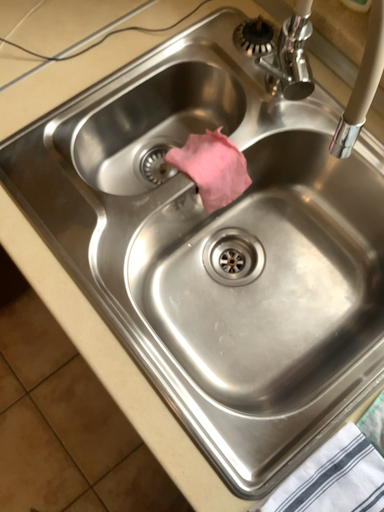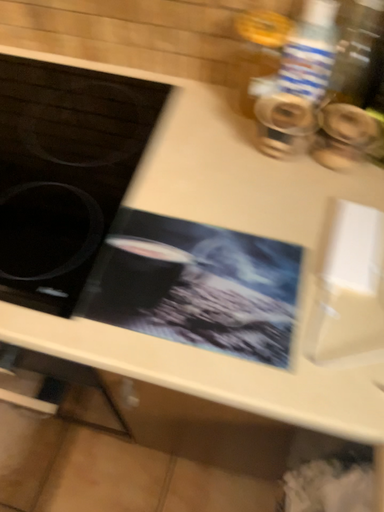
Question: How did the camera likely rotate when shooting the video?

Choices:
 (A) rotated left
 (B) rotated right

Answer: (A)